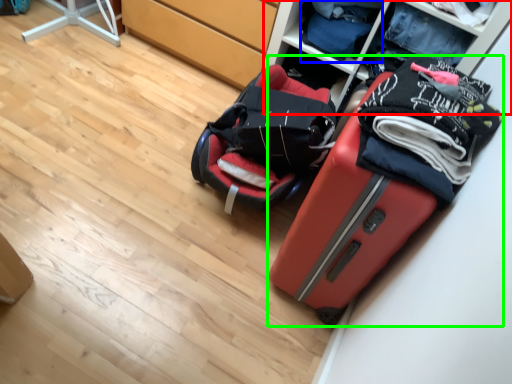
Question: Estimate the real-world distances between objects in this image. Which object is farther from shelf (highlighted by a red box), clothing (highlighted by a blue box) or suitcase (highlighted by a green box)?

Choices:
 (A) clothing
 (B) suitcase

Answer: (B)